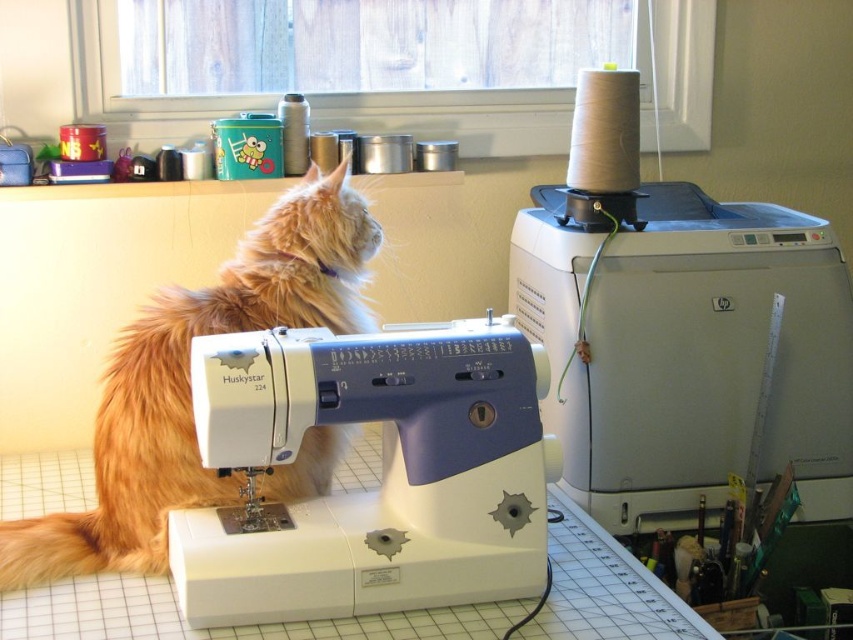
Question: Does white plastic sewing machine at center lie behind fuzzy orange cat at left?

Choices:
 (A) no
 (B) yes

Answer: (A)

Question: Among these points, which one is farthest from the camera?

Choices:
 (A) (283, 227)
 (B) (786, 282)

Answer: (B)

Question: Does white plastic sewing machine at center lie behind fuzzy orange cat at left?

Choices:
 (A) no
 (B) yes

Answer: (A)

Question: Based on their relative distances, which object is farther from the fuzzy orange cat at left?

Choices:
 (A) white plastic sewing machine at upper right
 (B) white plastic sewing machine at center

Answer: (A)

Question: Which point is farther to the camera?

Choices:
 (A) white plastic sewing machine at upper right
 (B) white plastic sewing machine at center
 (C) fuzzy orange cat at left

Answer: (A)

Question: Can you confirm if white plastic sewing machine at upper right is wider than fuzzy orange cat at left?

Choices:
 (A) yes
 (B) no

Answer: (A)